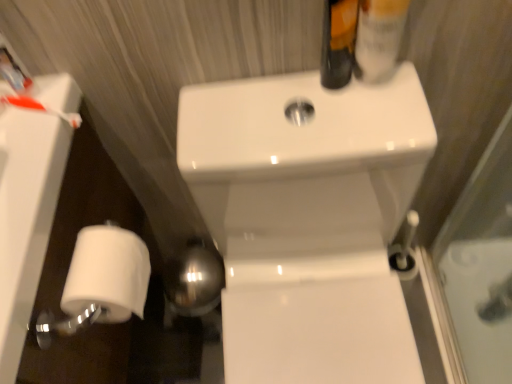
This screenshot has height=384, width=512. I want to click on blank space to the left of translucent plastic mouthwash at upper right, so click(x=269, y=105).